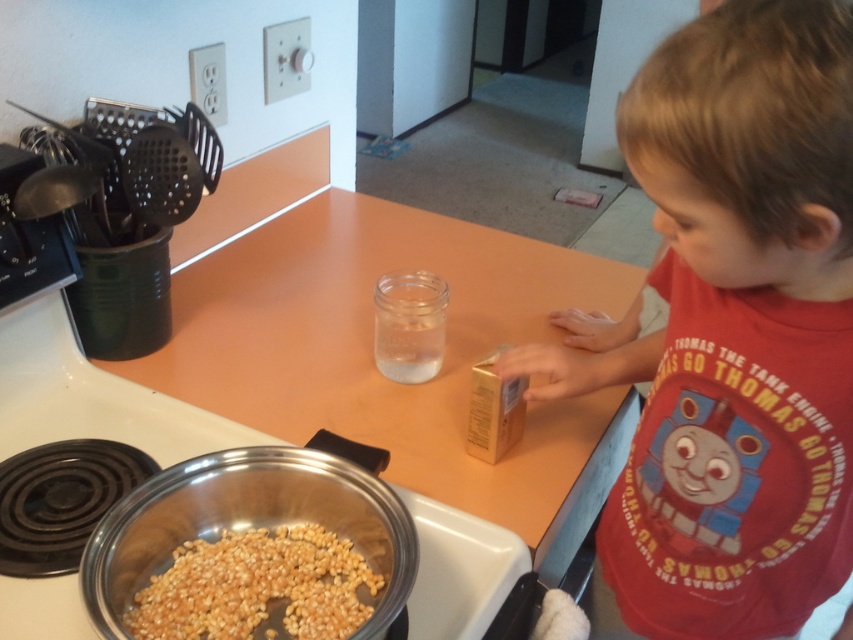
Where is the stainless steel pot at lower left located in the image?

The stainless steel pot at lower left is located at point (91, 396) in the image.

You are a chef preparing a snack for a child. You have a stainless steel pot at lower left and yellow matte popcorn at lower left. Which item is bigger?

The stainless steel pot at lower left is larger in size than the yellow matte popcorn at lower left, so the pot is bigger.